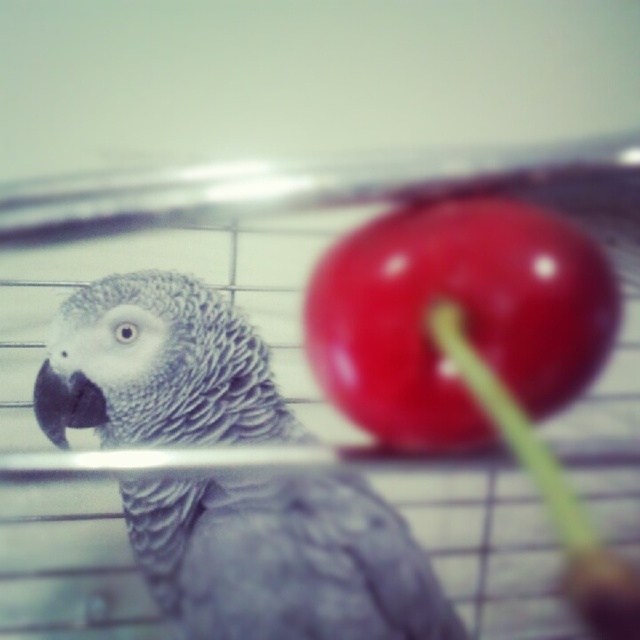
In the scene shown: Can you confirm if gray matte parrot at center is positioned above shiny red cherry at center?

Actually, gray matte parrot at center is below shiny red cherry at center.

Can you confirm if gray matte parrot at center is bigger than shiny red cherry at center?

Yes.

Is point (52, 333) farther from viewer compared to point (310, 368)?

No.

This screenshot has width=640, height=640. In order to click on gray matte parrot at center in this screenshot , I will do `click(282, 556)`.